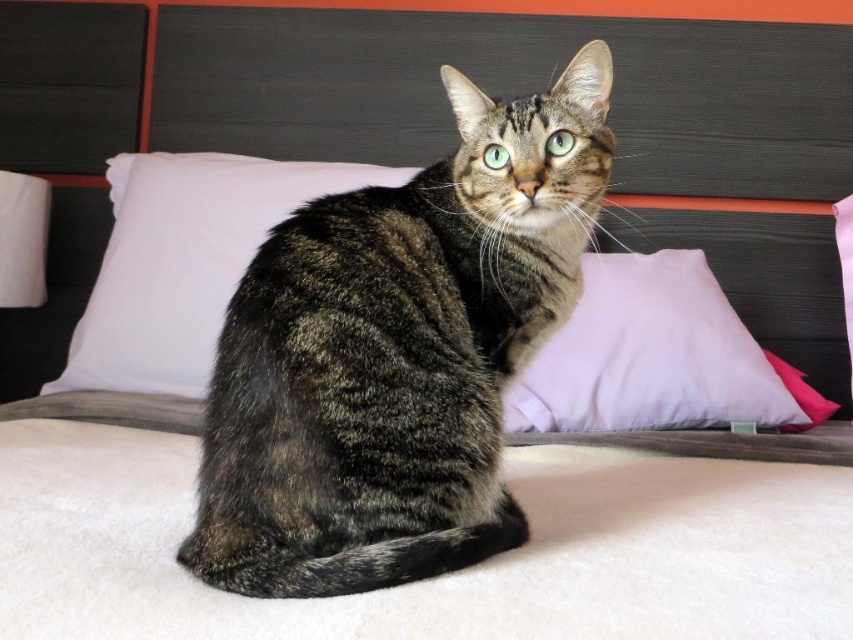
Question: Which of the following is the closest to the observer?

Choices:
 (A) pink fabric pillow at center
 (B) shiny brown fur cat at center

Answer: (B)

Question: Observing the image, what is the correct spatial positioning of shiny brown fur cat at center in reference to pink fabric pillow at center?

Choices:
 (A) below
 (B) above

Answer: (B)

Question: Where is shiny brown fur cat at center located in relation to white soft pillow at center in the image?

Choices:
 (A) left
 (B) right

Answer: (B)

Question: Among these objects, which one is farthest from the camera?

Choices:
 (A) pink fabric pillow at center
 (B) shiny brown fur cat at center

Answer: (A)

Question: Is shiny brown fur cat at center positioned behind white soft pillow at center?

Choices:
 (A) no
 (B) yes

Answer: (A)

Question: Which of these objects is positioned closest to the pink fabric pillow at center?

Choices:
 (A) white soft pillow at center
 (B) shiny brown fur cat at center

Answer: (B)